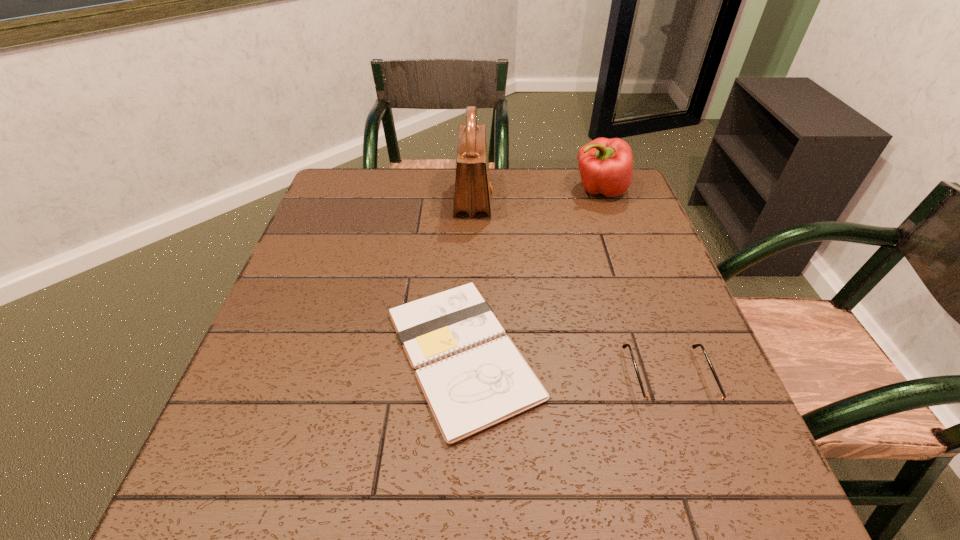
Find the location of a particular element. This screenshot has width=960, height=540. the tallest object is located at coordinates (473, 192).

The height and width of the screenshot is (540, 960). Find the location of `bell pepper`. bell pepper is located at coordinates (606, 165).

Where is `the second shortest object`? The width and height of the screenshot is (960, 540). the second shortest object is located at coordinates (651, 403).

In order to click on notepad in this screenshot , I will do `click(473, 377)`.

At what (x,y) coordinates should I click in order to perform the action: click on free space located 0.150m on the front flap of the tallest object. Please return your answer as a coordinate pair (x, y). Looking at the image, I should click on (544, 201).

Find the location of `free space located on the front of the bell pepper`. free space located on the front of the bell pepper is located at coordinates (621, 249).

Find the location of a particular element. vacant space located at the hinge ends of the third tallest object is located at coordinates (711, 504).

Find the location of a particular element. Image resolution: width=960 pixels, height=540 pixels. vacant area situated on the right of the notepad is located at coordinates (702, 354).

The image size is (960, 540). What are the coordinates of `shoulder bag positioned at the far edge` in the screenshot? It's located at (473, 192).

Locate an element on the screen. The width and height of the screenshot is (960, 540). bell pepper situated at the far edge is located at coordinates (606, 165).